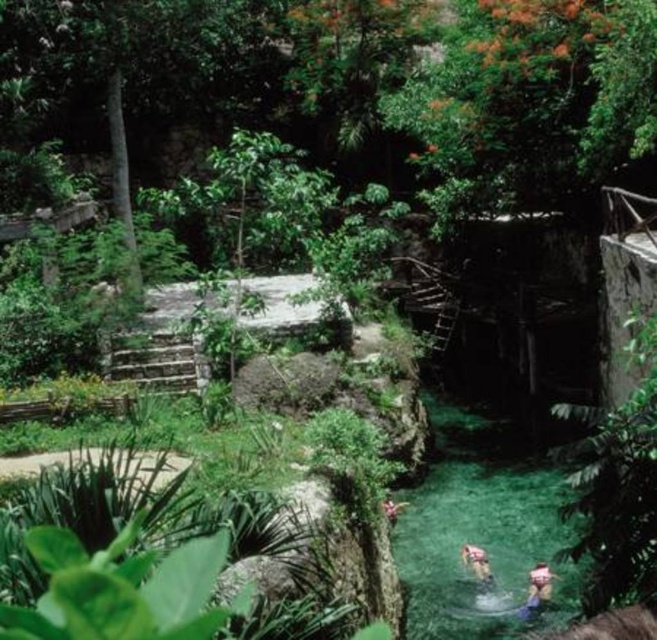
Question: Which object is the closest to the yellow fabric person at lower center?

Choices:
 (A) green leafy plant at lower right
 (B) light brown fabric person at lower center

Answer: (B)

Question: Which point appears closest to the camera in this image?

Choices:
 (A) (541, 572)
 (B) (390, 518)

Answer: (A)

Question: Can you confirm if green leafy plant at lower right is positioned below yellow-green fabric at lower right?

Choices:
 (A) no
 (B) yes

Answer: (A)

Question: Is yellow-green fabric at lower right wider than yellow fabric person at lower center?

Choices:
 (A) yes
 (B) no

Answer: (B)

Question: Is green leafy plant at lower right in front of yellow-green fabric at lower right?

Choices:
 (A) no
 (B) yes

Answer: (B)

Question: Which point appears farthest from the camera in this image?

Choices:
 (A) (578, 419)
 (B) (397, 508)
 (C) (528, 596)

Answer: (B)